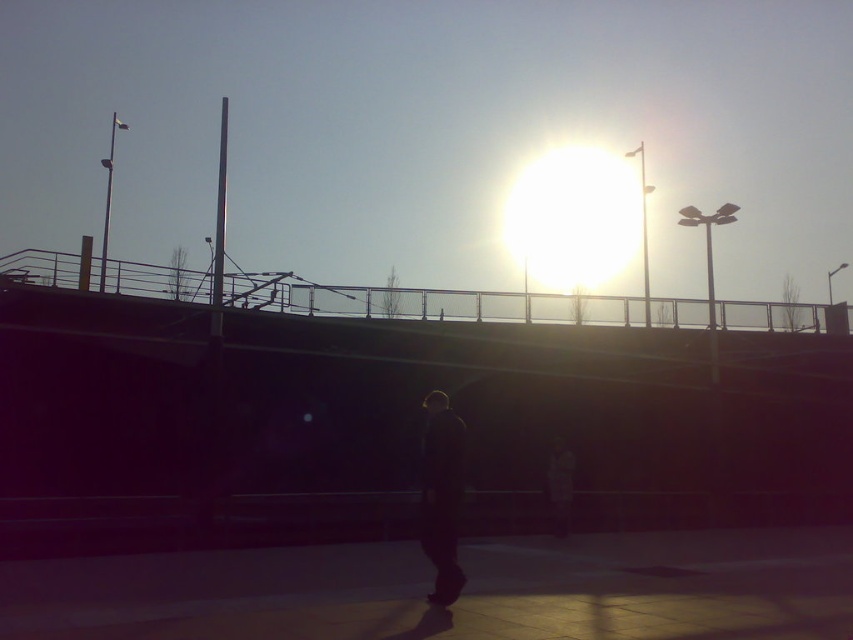
Question: Which point appears closest to the camera in this image?

Choices:
 (A) (547, 465)
 (B) (457, 419)

Answer: (B)

Question: Does dark fabric jacket at center come behind dark gray jacket at center?

Choices:
 (A) yes
 (B) no

Answer: (B)

Question: Does dark fabric jacket at center appear over dark gray jacket at center?

Choices:
 (A) no
 (B) yes

Answer: (B)

Question: From the image, what is the correct spatial relationship of dark fabric jacket at center in relation to dark gray jacket at center?

Choices:
 (A) above
 (B) below

Answer: (A)